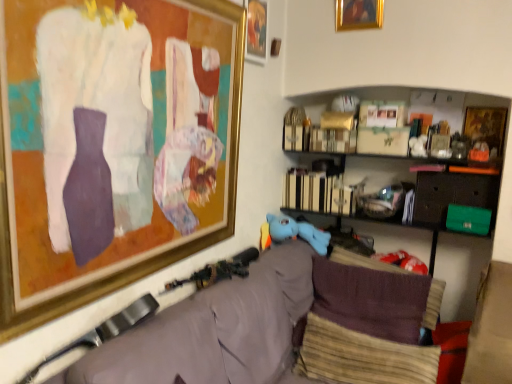
Question: Considering the relative positions of gold-framed picture at upper center, the second picture frame when ordered from left to right, and gold-framed painting at upper center, the second picture frame viewed from the right, in the image provided, is gold-framed picture at upper center, the second picture frame when ordered from left to right, to the left of gold-framed painting at upper center, the second picture frame viewed from the right, from the viewer's perspective?

Choices:
 (A) no
 (B) yes

Answer: (B)

Question: Is gold-framed picture at upper center, which ranks as the third picture frame in right-to-left order, wider than gold-framed painting at upper center, which is the 3th picture frame in left-to-right order?

Choices:
 (A) yes
 (B) no

Answer: (B)

Question: Is gold-framed picture at upper center, the second picture frame when ordered from left to right, touching gold-framed painting at upper center, which is the 3th picture frame in left-to-right order?

Choices:
 (A) yes
 (B) no

Answer: (B)

Question: Is gold-framed picture at upper center, the second picture frame when ordered from left to right, thinner than gold-framed painting at upper center, which is the 3th picture frame in left-to-right order?

Choices:
 (A) yes
 (B) no

Answer: (A)

Question: Would you say gold-framed picture at upper center, which ranks as the third picture frame in right-to-left order, contains gold-framed painting at upper center, which is the 3th picture frame in left-to-right order?

Choices:
 (A) yes
 (B) no

Answer: (B)

Question: From the image's perspective, relative to velvet grey couch at lower center, is gold-framed painting at upper left, the fourth picture frame viewed from the right, above or below?

Choices:
 (A) above
 (B) below

Answer: (A)

Question: Considering the positions of gold-framed painting at upper left, which is the first picture frame in left-to-right order, and velvet grey couch at lower center in the image, is gold-framed painting at upper left, which is the first picture frame in left-to-right order, bigger or smaller than velvet grey couch at lower center?

Choices:
 (A) small
 (B) big

Answer: (A)

Question: From a real-world perspective, is gold-framed painting at upper left, the fourth picture frame viewed from the right, above or below velvet grey couch at lower center?

Choices:
 (A) above
 (B) below

Answer: (A)

Question: Considering the positions of gold-framed painting at upper left, the fourth picture frame viewed from the right, and velvet grey couch at lower center in the image, is gold-framed painting at upper left, the fourth picture frame viewed from the right, wider or thinner than velvet grey couch at lower center?

Choices:
 (A) wide
 (B) thin

Answer: (B)

Question: Relative to beige textured pillow at lower right, placed as the first pillow when sorted from front to back, is gold-framed painting at upper center, the second picture frame viewed from the right, in front or behind?

Choices:
 (A) behind
 (B) front

Answer: (A)

Question: From the image's perspective, is gold-framed painting at upper center, which is the 3th picture frame in left-to-right order, positioned above or below beige textured pillow at lower right, placed as the first pillow when sorted from front to back?

Choices:
 (A) below
 (B) above

Answer: (B)

Question: Is gold-framed painting at upper center, the second picture frame viewed from the right, to the left or to the right of beige textured pillow at lower right, placed as the first pillow when sorted from front to back, in the image?

Choices:
 (A) right
 (B) left

Answer: (A)

Question: From a real-world perspective, is gold-framed painting at upper center, which is the 3th picture frame in left-to-right order, physically located above or below beige textured pillow at lower right, the 2th pillow positioned from the back?

Choices:
 (A) below
 (B) above

Answer: (B)

Question: Would you say gold-framed picture at upper center, which ranks as the third picture frame in right-to-left order, is inside or outside woolen fabric pillow at center, the 1th pillow when ordered from back to front?

Choices:
 (A) inside
 (B) outside

Answer: (B)

Question: Is gold-framed picture at upper center, which ranks as the third picture frame in right-to-left order, in front of or behind woolen fabric pillow at center, the 1th pillow when ordered from back to front, in the image?

Choices:
 (A) front
 (B) behind

Answer: (A)